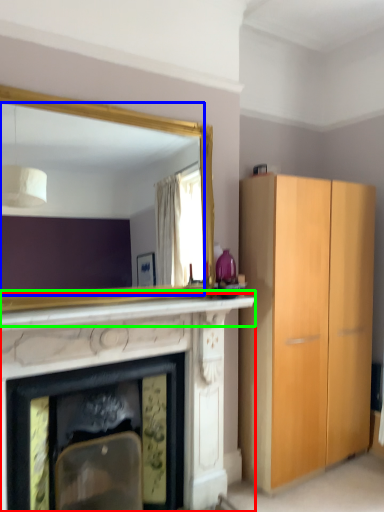
Question: Based on their relative distances, which object is nearer to fireplace (highlighted by a red box)? Choose from mirror (highlighted by a blue box) and mantle (highlighted by a green box).

Choices:
 (A) mirror
 (B) mantle

Answer: (B)